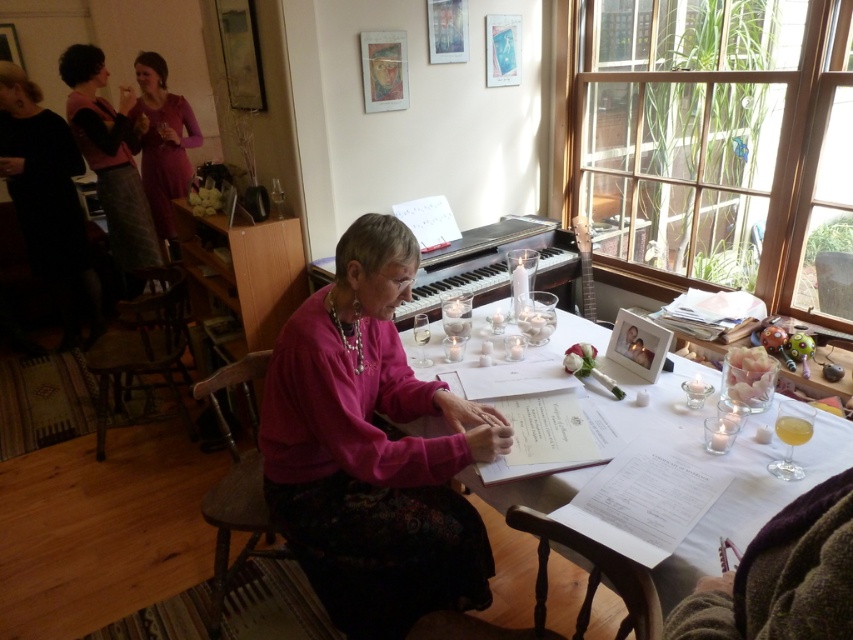
Is point (509, 561) farther from viewer compared to point (554, 266)?

No.

Locate an element on the screen. The height and width of the screenshot is (640, 853). white paper at center is located at coordinates (708, 458).

Does point (549, 500) come in front of point (494, 273)?

Yes, point (549, 500) is closer to viewer.

This screenshot has height=640, width=853. I want to click on white paper at center, so click(708, 458).

Does point (496, 232) come behind point (148, 74)?

No, (496, 232) is in front of (148, 74).

Can you confirm if black polished piano at center is positioned above matte pink dress at upper left?

No, black polished piano at center is not above matte pink dress at upper left.

Where is `black polished piano at center`? black polished piano at center is located at coordinates (489, 264).

Can you confirm if pink fabric at center is positioned below white paper at center?

Indeed, pink fabric at center is positioned under white paper at center.

Measure the distance from pink fabric at center to white paper at center.

pink fabric at center and white paper at center are 14.48 inches apart.

Between point (438, 604) and point (444, 429), which one is positioned in front?

Positioned in front is point (438, 604).

Where is `pink fabric at center`? The image size is (853, 640). pink fabric at center is located at coordinates (370, 451).